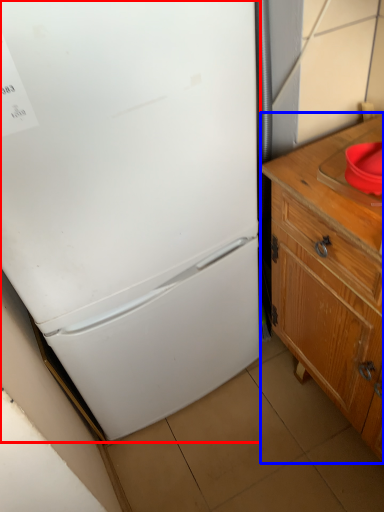
Question: Among these objects, which one is nearest to the camera, refrigerator (highlighted by a red box) or cabinetry (highlighted by a blue box)?

Choices:
 (A) refrigerator
 (B) cabinetry

Answer: (A)